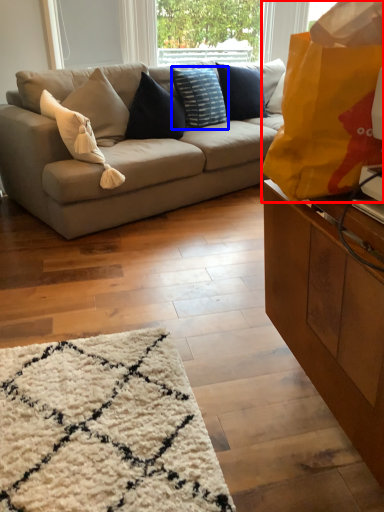
Question: Among these objects, which one is nearest to the camera, bag (highlighted by a red box) or pillow (highlighted by a blue box)?

Choices:
 (A) bag
 (B) pillow

Answer: (A)